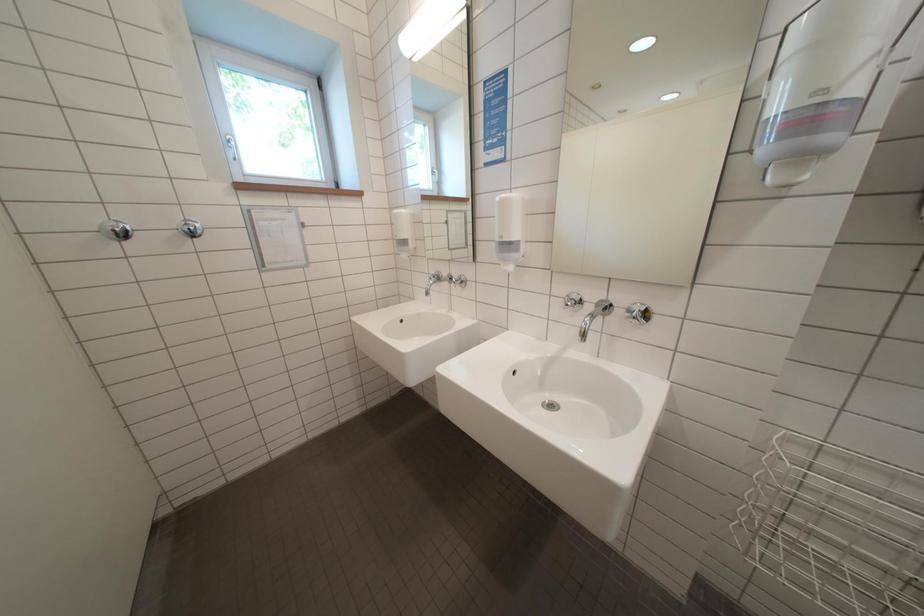
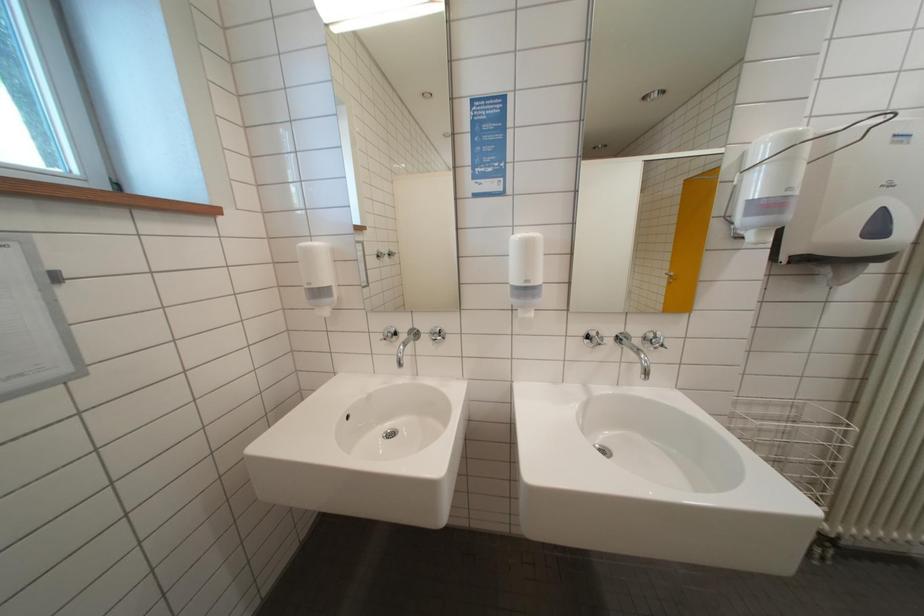
Question: The camera is either moving clockwise (left) or counter-clockwise (right) around the object. The first image is from the beginning of the video and the second image is from the end. Is the camera moving left or right when shooting the video?

Choices:
 (A) Left
 (B) Right

Answer: (A)